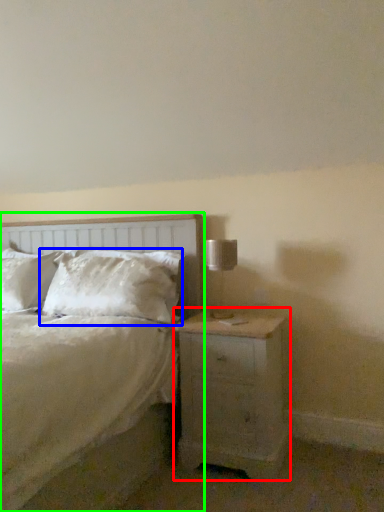
Question: Estimate the real-world distances between objects in this image. Which object is farther from nightstand (highlighted by a red box), pillow (highlighted by a blue box) or bed (highlighted by a green box)?

Choices:
 (A) pillow
 (B) bed

Answer: (B)